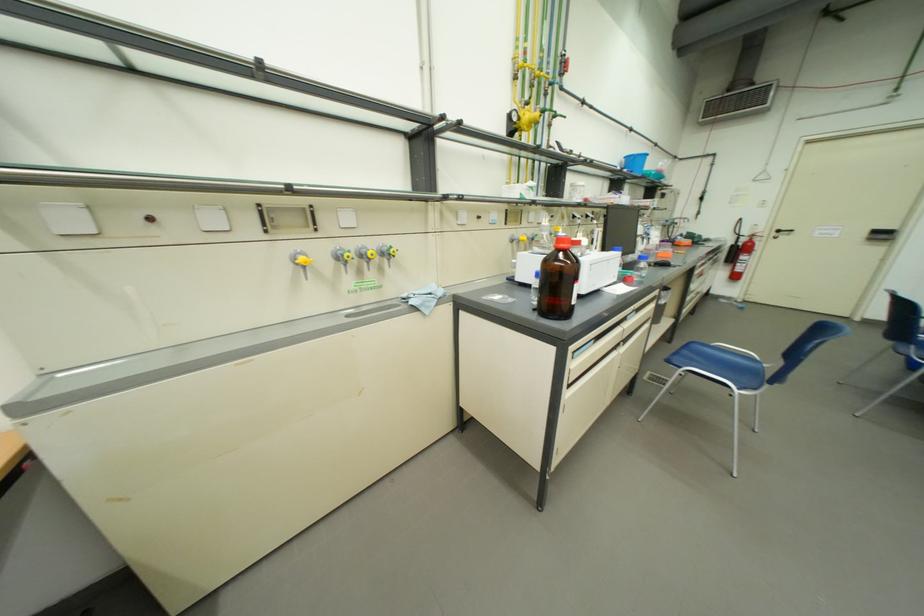
At what (x,y) coordinates should I click in order to perform the action: click on chair sitting surface. Please return your answer as a coordinate pair (x, y). The image size is (924, 616). Looking at the image, I should click on (720, 363).